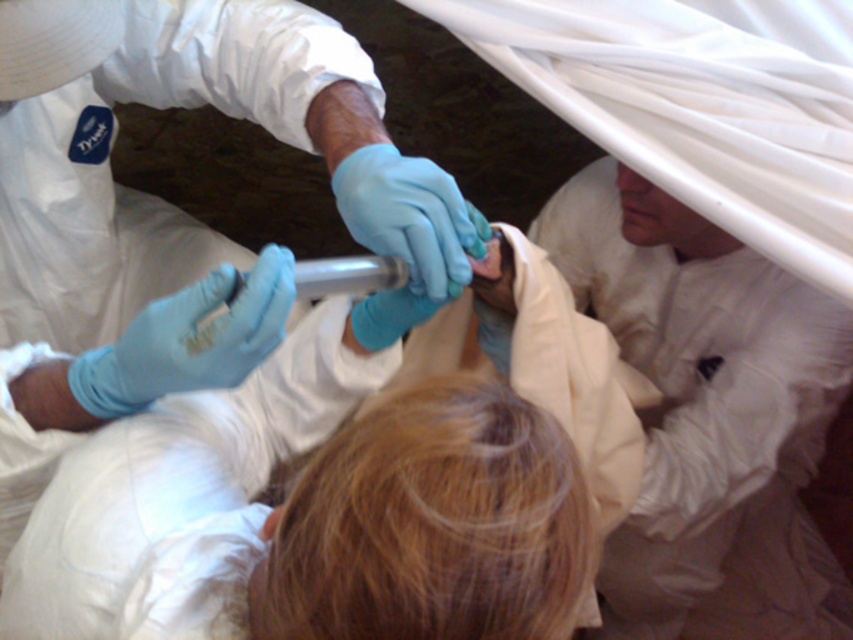
Does white matte/soft fabric at upper right appear on the right side of silver metallic syringe at center?

Yes, white matte/soft fabric at upper right is to the right of silver metallic syringe at center.

The width and height of the screenshot is (853, 640). I want to click on white matte/soft fabric at upper right, so click(x=708, y=417).